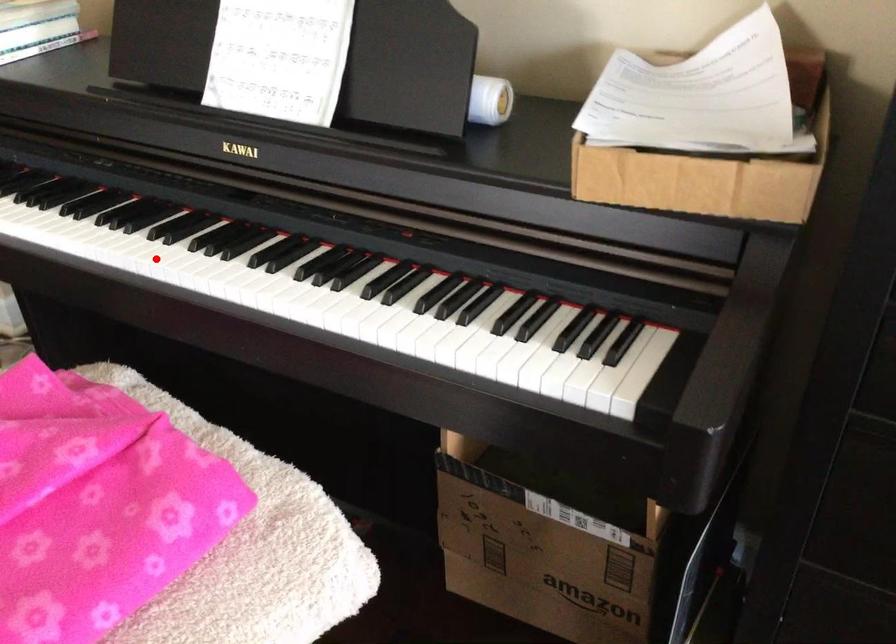
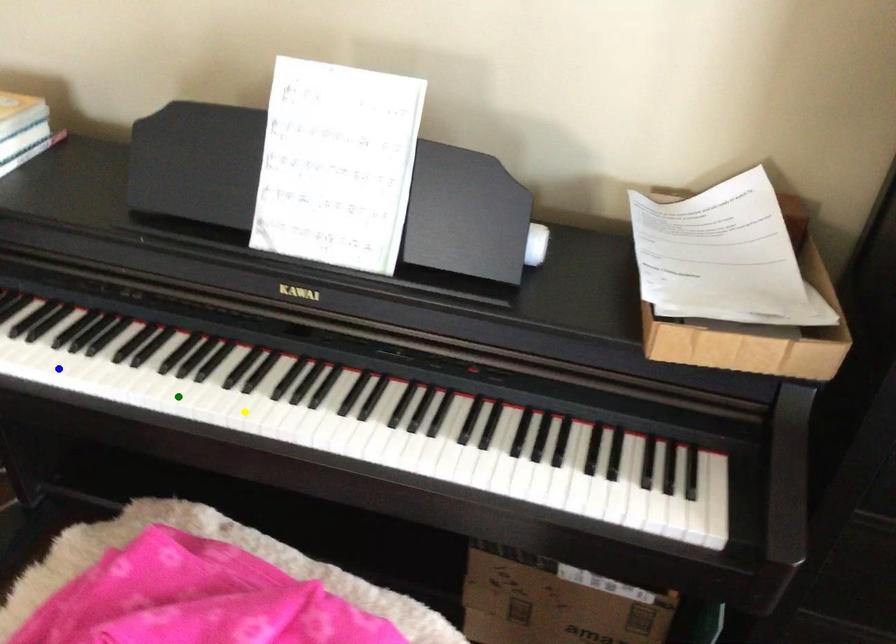
Question: I am providing you with two images of the same scene from different viewpoints. A red point is marked on the first image. You are given multiple points on the second image. Which point in image 2 is actually the same real-world point as the red point in image 1?

Choices:
 (A) blue point
 (B) yellow point
 (C) green point

Answer: (B)